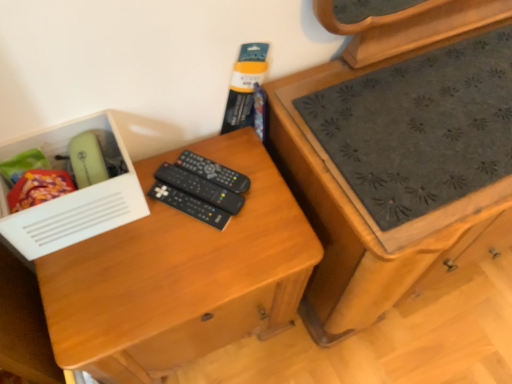
Image resolution: width=512 pixels, height=384 pixels. What do you see at coordinates (189, 205) in the screenshot? I see `black plastic remote controls at center, acting as the 3th remote control starting from the top` at bounding box center [189, 205].

Find the location of a particular element. This screenshot has height=384, width=512. wooden chest of drawers at right is located at coordinates (398, 153).

What do you see at coordinates (213, 172) in the screenshot? Image resolution: width=512 pixels, height=384 pixels. I see `black plastic remote controls at center, which is counted as the 1th remote control, starting from the top` at bounding box center [213, 172].

Measure the distance between wooden desk at center and camera.

wooden desk at center is 29.61 inches away from camera.

Describe the element at coordinates (181, 278) in the screenshot. I see `wooden desk at center` at that location.

Identify the location of white plastic box at left. The width and height of the screenshot is (512, 384). (73, 192).

This screenshot has width=512, height=384. Identify the location of black plastic remote controls at center, acting as the 3th remote control starting from the top. (189, 205).

How different are the orientations of black plastic remote controls at center, acting as the 3th remote control starting from the top, and white plastic box at left in degrees?

They differ by 38.8 degrees in their facing directions.

Is black plastic remote controls at center, acting as the 3th remote control starting from the top, looking in the opposite direction of white plastic box at left?

That's right, black plastic remote controls at center, acting as the 3th remote control starting from the top, is facing away from white plastic box at left.

Does black plastic remote controls at center, acting as the 3th remote control starting from the top, have a greater width compared to white plastic box at left?

Yes, black plastic remote controls at center, acting as the 3th remote control starting from the top, is wider than white plastic box at left.

Based on the photo, from a real-world perspective, is black plastic remote controls at center, acting as the 3th remote control starting from the top, physically below white plastic box at left?

Yes, from a real-world perspective, black plastic remote controls at center, acting as the 3th remote control starting from the top, is below white plastic box at left.

You are a GUI agent. You are given a task and a screenshot of the screen. Output one action in this format:
    pyautogui.click(x=<x>, y=<y>)
    Task: Click on the box that is below the black plastic remote controls at center, which is counted as the 1th remote control, starting from the top (from the image's perspective)
    The image size is (512, 384).
    Given the screenshot: What is the action you would take?
    pyautogui.click(x=73, y=192)

Considering the relative sizes of white plastic box at left and black plastic remote controls at center, which is counted as the 1th remote control, starting from the top, in the image provided, is white plastic box at left thinner than black plastic remote controls at center, which is counted as the 1th remote control, starting from the top,?

Yes, white plastic box at left is thinner than black plastic remote controls at center, which is counted as the 1th remote control, starting from the top.

From a real-world perspective, who is located lower, white plastic box at left or black plastic remote controls at center, positioned as the third remote control in bottom-to-top order?

In real-world perspective, black plastic remote controls at center, positioned as the third remote control in bottom-to-top order, is lower.

Which is behind, white plastic box at left or black plastic remote controls at center, positioned as the third remote control in bottom-to-top order?

Positioned behind is black plastic remote controls at center, positioned as the third remote control in bottom-to-top order.

Is point (191, 151) positioned behind point (329, 307)?

No, (191, 151) is in front of (329, 307).

Which is in front, black plastic remote controls at center, positioned as the third remote control in bottom-to-top order, or wooden chest of drawers at right?

wooden chest of drawers at right.

Is black plastic remote controls at center, which is counted as the 1th remote control, starting from the top, located outside wooden chest of drawers at right?

Yes.

Is wooden desk at center in front of or behind black plastic remote controls at center, which ranks as the 1th remote control in bottom-to-top order, in the image?

wooden desk at center is in front of black plastic remote controls at center, which ranks as the 1th remote control in bottom-to-top order.

Is wooden desk at center to the left of black plastic remote controls at center, which ranks as the 1th remote control in bottom-to-top order, from the viewer's perspective?

Indeed, wooden desk at center is positioned on the left side of black plastic remote controls at center, which ranks as the 1th remote control in bottom-to-top order.

Is black plastic remote controls at center, which ranks as the 1th remote control in bottom-to-top order, surrounded by wooden desk at center?

Absolutely, black plastic remote controls at center, which ranks as the 1th remote control in bottom-to-top order, is inside wooden desk at center.

Does black plastic remote controls at center, which ranks as the 1th remote control in bottom-to-top order, appear on the left side of wooden chest of drawers at right?

Yes, black plastic remote controls at center, which ranks as the 1th remote control in bottom-to-top order, is to the left of wooden chest of drawers at right.

Does point (184, 197) appear closer or farther from the camera than point (374, 304)?

Point (184, 197) appears to be closer to the viewer than point (374, 304).

Can you confirm if black plastic remote controls at center, which ranks as the 1th remote control in bottom-to-top order, is taller than wooden chest of drawers at right?

No.

How different are the orientations of black plastic remote controls at center, acting as the 3th remote control starting from the top, and wooden chest of drawers at right in degrees?

They differ by 38.1 degrees in their facing directions.

From a real-world perspective, does black plastic remote controls at center, which ranks as the 1th remote control in bottom-to-top order, sit lower than wooden desk at center?

No, from a real-world perspective, black plastic remote controls at center, which ranks as the 1th remote control in bottom-to-top order, is not beneath wooden desk at center.

Are black plastic remote controls at center, acting as the 3th remote control starting from the top, and wooden desk at center located far from each other?

No, there isn't a large distance between black plastic remote controls at center, acting as the 3th remote control starting from the top, and wooden desk at center.

Is black plastic remote controls at center, acting as the 3th remote control starting from the top, oriented away from wooden desk at center?

Yes, wooden desk at center is at the back of black plastic remote controls at center, acting as the 3th remote control starting from the top.

What are the coordinates of `the 1st remote control behind when counting from the wooden desk at center` in the screenshot? It's located at (189, 205).

Locate an element on the screen. the 1st remote control behind when counting from the black plastic remote controls at center, which ranks as the 1th remote control in bottom-to-top order is located at coordinates (200, 188).

Are black plastic remote controls at center, acting as the 3th remote control starting from the top, and black plastic remote controls at center, which is the 2th remote control from top to bottom, far apart?

No, black plastic remote controls at center, acting as the 3th remote control starting from the top, is in close proximity to black plastic remote controls at center, which is the 2th remote control from top to bottom.

In terms of size, does black plastic remote controls at center, which ranks as the 1th remote control in bottom-to-top order, appear bigger or smaller than black plastic remote controls at center, which is the 2th remote control from top to bottom?

black plastic remote controls at center, which ranks as the 1th remote control in bottom-to-top order, is smaller than black plastic remote controls at center, which is the 2th remote control from top to bottom.

Could you tell me if black plastic remote controls at center, which ranks as the 1th remote control in bottom-to-top order, is turned towards black plastic remote controls at center, which is the 2th remote control from top to bottom?

No, black plastic remote controls at center, which ranks as the 1th remote control in bottom-to-top order, does not turn towards black plastic remote controls at center, which is the 2th remote control from top to bottom.

This screenshot has width=512, height=384. I want to click on box lying on the left of black plastic remote controls at center, acting as the 3th remote control starting from the top, so click(73, 192).

Where is `the 3rd remote control to the right when counting from the white plastic box at left`? the 3rd remote control to the right when counting from the white plastic box at left is located at coordinates pyautogui.click(x=213, y=172).

Considering their positions, is wooden chest of drawers at right positioned further to black plastic remote controls at center, which is counted as the 1th remote control, starting from the top, than black plastic remote controls at center, the second remote control positioned from the bottom?

wooden chest of drawers at right lies further to black plastic remote controls at center, which is counted as the 1th remote control, starting from the top, than the other object.

Looking at this image, which object lies nearer to the anchor point wooden chest of drawers at right, black plastic remote controls at center, the second remote control positioned from the bottom, or black plastic remote controls at center, acting as the 3th remote control starting from the top?

Based on the image, black plastic remote controls at center, the second remote control positioned from the bottom, appears to be nearer to wooden chest of drawers at right.

Looking at this image, based on their spatial positions, is wooden chest of drawers at right or black plastic remote controls at center, which is counted as the 1th remote control, starting from the top, further from black plastic remote controls at center, acting as the 3th remote control starting from the top?

The object further to black plastic remote controls at center, acting as the 3th remote control starting from the top, is wooden chest of drawers at right.

Estimate the real-world distances between objects in this image. Which object is closer to wooden chest of drawers at right, black plastic remote controls at center, which is counted as the 1th remote control, starting from the top, or black plastic remote controls at center, which ranks as the 1th remote control in bottom-to-top order?

black plastic remote controls at center, which is counted as the 1th remote control, starting from the top, is positioned closer to the anchor wooden chest of drawers at right.

When comparing their distances from white plastic box at left, does wooden chest of drawers at right or black plastic remote controls at center, acting as the 3th remote control starting from the top, seem closer?

The object closer to white plastic box at left is black plastic remote controls at center, acting as the 3th remote control starting from the top.

Which object lies nearer to the anchor point black plastic remote controls at center, which is the 2th remote control from top to bottom, black plastic remote controls at center, which ranks as the 1th remote control in bottom-to-top order, or black plastic remote controls at center, positioned as the third remote control in bottom-to-top order?

Based on the image, black plastic remote controls at center, which ranks as the 1th remote control in bottom-to-top order, appears to be nearer to black plastic remote controls at center, which is the 2th remote control from top to bottom.

Looking at the image, which one is located further to wooden desk at center, black plastic remote controls at center, positioned as the third remote control in bottom-to-top order, or black plastic remote controls at center, which is the 2th remote control from top to bottom?

Among the two, black plastic remote controls at center, positioned as the third remote control in bottom-to-top order, is located further to wooden desk at center.

Which object lies further to the anchor point white plastic box at left, black plastic remote controls at center, which is the 2th remote control from top to bottom, or black plastic remote controls at center, which is counted as the 1th remote control, starting from the top?

black plastic remote controls at center, which is counted as the 1th remote control, starting from the top, lies further to white plastic box at left than the other object.

Where is `desk between white plastic box at left and wooden chest of drawers at right`? Image resolution: width=512 pixels, height=384 pixels. desk between white plastic box at left and wooden chest of drawers at right is located at coordinates point(181,278).

In order to click on box between black plastic remote controls at center, which is counted as the 1th remote control, starting from the top, and wooden desk at center vertically in this screenshot , I will do `click(73, 192)`.

The height and width of the screenshot is (384, 512). Find the location of `remote control between white plastic box at left and black plastic remote controls at center, which is the 2th remote control from top to bottom, from left to right`. remote control between white plastic box at left and black plastic remote controls at center, which is the 2th remote control from top to bottom, from left to right is located at coordinates (189, 205).

At what (x,y) coordinates should I click in order to perform the action: click on remote control situated between black plastic remote controls at center, which is the 2th remote control from top to bottom, and wooden chest of drawers at right from left to right. Please return your answer as a coordinate pair (x, y). The width and height of the screenshot is (512, 384). Looking at the image, I should click on (213, 172).